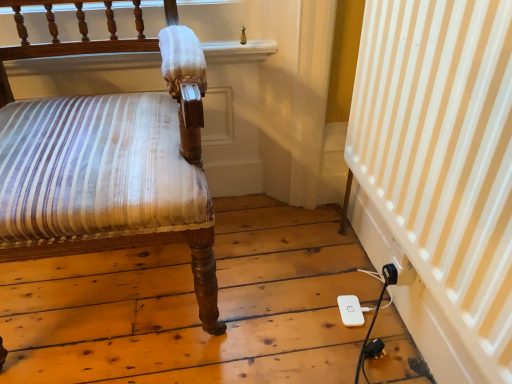
Where is `empty space that is in between matte brown wood chair at left and white striped curtain at lower right`? The height and width of the screenshot is (384, 512). empty space that is in between matte brown wood chair at left and white striped curtain at lower right is located at coordinates (273, 295).